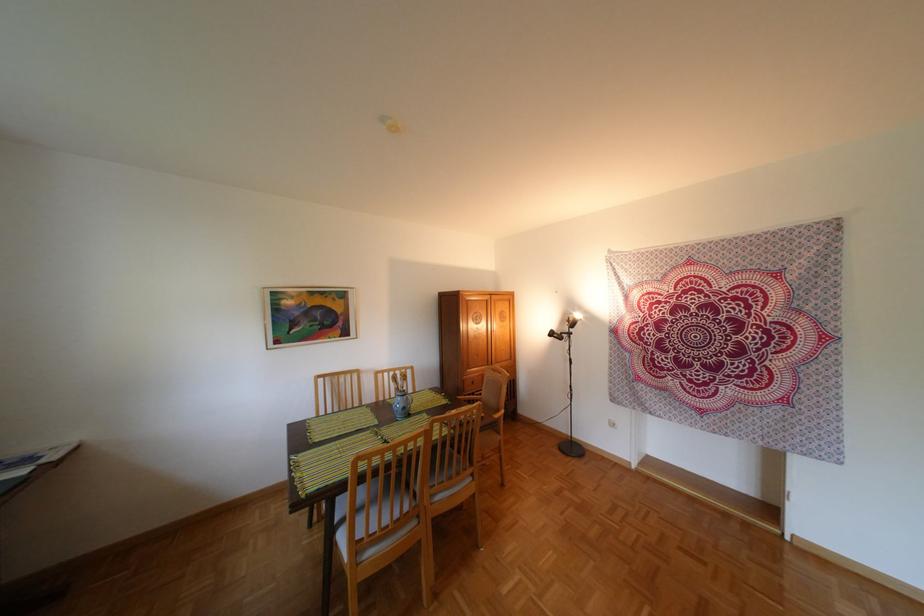
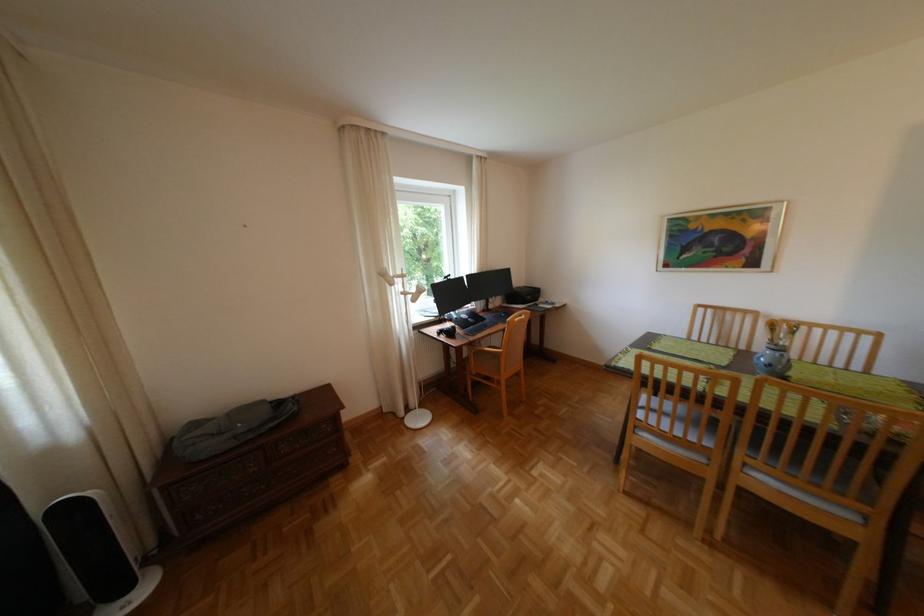
Question: The camera is either moving clockwise (left) or counter-clockwise (right) around the object. The first image is from the beginning of the video and the second image is from the end. Is the camera moving left or right when shooting the video?

Choices:
 (A) Left
 (B) Right

Answer: (B)